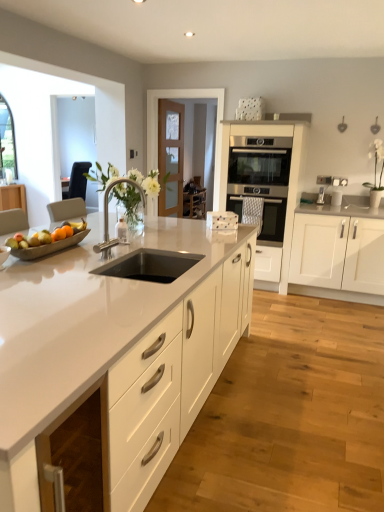
Question: Does wooden chair at center have a lesser width compared to black stainless steel sink at center?

Choices:
 (A) yes
 (B) no

Answer: (B)

Question: From the image's perspective, is wooden chair at center on black stainless steel sink at center?

Choices:
 (A) no
 (B) yes

Answer: (B)

Question: Does wooden chair at center contain black stainless steel sink at center?

Choices:
 (A) yes
 (B) no

Answer: (B)

Question: Is wooden chair at center oriented towards black stainless steel sink at center?

Choices:
 (A) no
 (B) yes

Answer: (A)

Question: Is wooden chair at center far from black stainless steel sink at center?

Choices:
 (A) no
 (B) yes

Answer: (B)

Question: Is satin stainless steel oven at center, arranged as the 2th cabinetry when viewed from the right, taller or shorter than wooden chair at center?

Choices:
 (A) tall
 (B) short

Answer: (A)

Question: Do you think satin stainless steel oven at center, arranged as the 2th cabinetry when viewed from the right, is within wooden chair at center, or outside of it?

Choices:
 (A) outside
 (B) inside

Answer: (A)

Question: Considering the positions of satin stainless steel oven at center, arranged as the 2th cabinetry when viewed from the right, and wooden chair at center in the image, is satin stainless steel oven at center, arranged as the 2th cabinetry when viewed from the right, bigger or smaller than wooden chair at center?

Choices:
 (A) small
 (B) big

Answer: (B)

Question: Looking at their shapes, would you say satin stainless steel oven at center, arranged as the 2th cabinetry when viewed from the right, is wider or thinner than wooden chair at center?

Choices:
 (A) wide
 (B) thin

Answer: (B)

Question: Is wooden chair at center bigger or smaller than white matte cabinet at right, the 3th cabinetry viewed from the left?

Choices:
 (A) small
 (B) big

Answer: (A)

Question: Considering the relative positions of wooden chair at center and white matte cabinet at right, the 3th cabinetry viewed from the left, in the image provided, is wooden chair at center to the left or to the right of white matte cabinet at right, the 3th cabinetry viewed from the left,?

Choices:
 (A) left
 (B) right

Answer: (A)

Question: Considering the positions of point (190, 180) and point (294, 279), is point (190, 180) closer or farther from the camera than point (294, 279)?

Choices:
 (A) farther
 (B) closer

Answer: (A)

Question: Is wooden chair at center wider or thinner than white matte cabinet at right, the 1th cabinetry viewed from the right?

Choices:
 (A) wide
 (B) thin

Answer: (A)

Question: From the image's perspective, relative to polished chrome faucet at center, is white matte cabinet at right, the 3th cabinetry viewed from the left, above or below?

Choices:
 (A) above
 (B) below

Answer: (B)

Question: Does point (360, 204) appear closer or farther from the camera than point (142, 196)?

Choices:
 (A) farther
 (B) closer

Answer: (A)